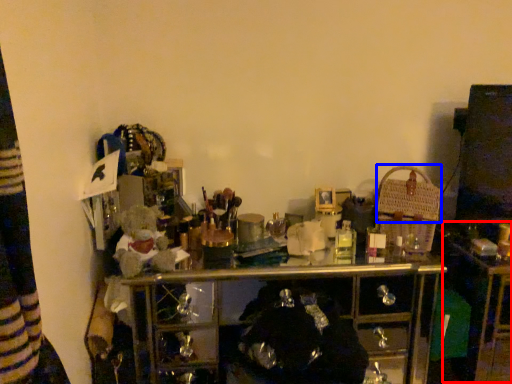
Question: Which of the following is the farthest to the observer, computer desk (highlighted by a red box) or basket (highlighted by a blue box)?

Choices:
 (A) computer desk
 (B) basket

Answer: (B)